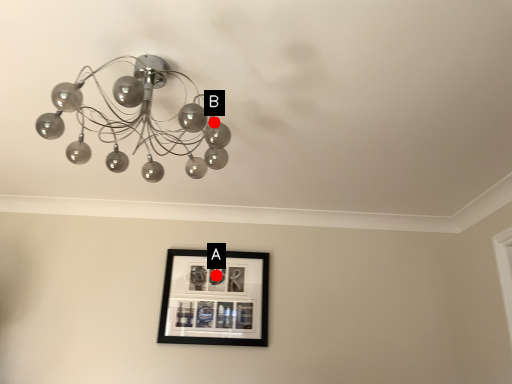
Question: Two points are circled on the image, labeled by A and B beside each circle. Which point appears farthest from the camera in this image?

Choices:
 (A) A is further
 (B) B is further

Answer: (A)